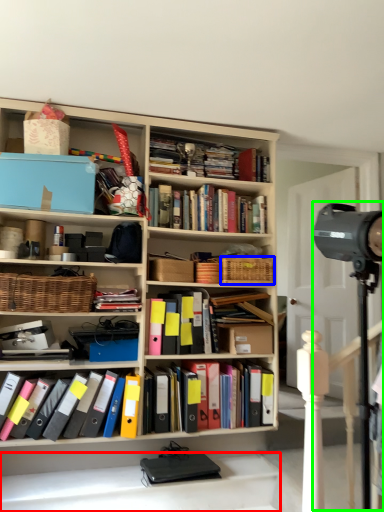
Question: Which object is positioned closest to stairwell (highlighted by a red box)? Select from basket (highlighted by a blue box) and television camera (highlighted by a green box).

Choices:
 (A) basket
 (B) television camera

Answer: (A)